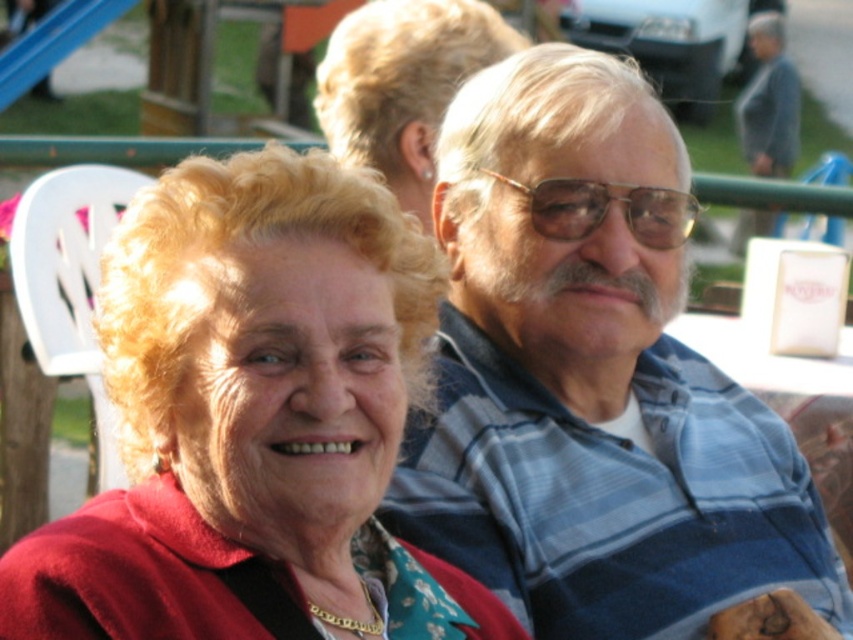
You are taking a photo of the blue striped shirt at upper right and the blonde hair at upper center. To ensure both are in focus, you need to know which one is closer to the camera. Can you determine which object is closer?

The blue striped shirt at upper right is taller than blonde hair at upper center, so the blue striped shirt at upper right is closer to the camera.

You are standing at point (x=526, y=598) and want to take a photo of the elderly woman and man. The camera you have can focus on subjects within 5 meters. Will you be able to capture both of them clearly in the same photo?

The elderly woman and man are 7.88 meters apart, which is beyond the camera focus range of 5 meters. Therefore, you cannot capture both of them clearly in the same photo.

You are a photographer trying to capture a candid shot of the two people in the image. You want to ensure that the matte red sweater at center and the blonde hair at upper center are both clearly visible in the frame. Given their relative sizes, which object might require you to adjust your focus or framing more carefully?

The blonde hair at upper center is smaller in height compared to the matte red sweater at center, so you might need to adjust focus or framing to ensure it remains visible alongside the larger object.